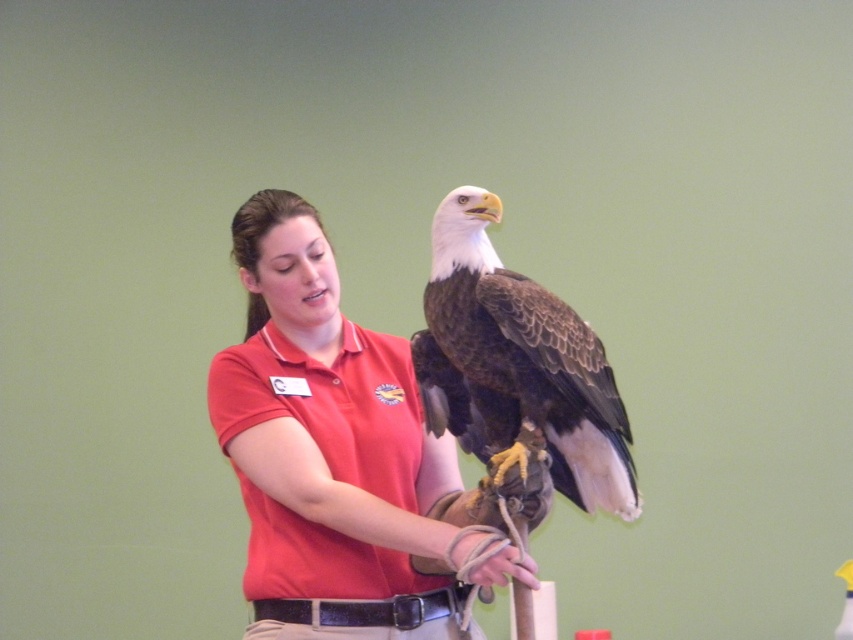
Does matte red shirt at center appear under brown feathered eagle at center?

Indeed, matte red shirt at center is positioned under brown feathered eagle at center.

Is matte red shirt at center in front of brown feathered eagle at center?

No, matte red shirt at center is further to the viewer.

You are a GUI agent. You are given a task and a screenshot of the screen. Output one action in this format:
    pyautogui.click(x=<x>, y=<y>)
    Task: Click on the matte red shirt at center
    This screenshot has height=640, width=853.
    Given the screenshot: What is the action you would take?
    pyautogui.click(x=326, y=448)

This screenshot has width=853, height=640. What do you see at coordinates (517, 365) in the screenshot? I see `brown feathered eagle at center` at bounding box center [517, 365].

Does point (560, 403) come farther from viewer compared to point (469, 550)?

Yes, it is behind point (469, 550).

This screenshot has width=853, height=640. What are the coordinates of `brown feathered eagle at center` in the screenshot? It's located at (517, 365).

Locate an element on the screen. matte red shirt at center is located at coordinates (326, 448).

Does point (355, 339) come behind point (498, 545)?

Yes, it is.

Locate an element on the screen. matte red shirt at center is located at coordinates (326, 448).